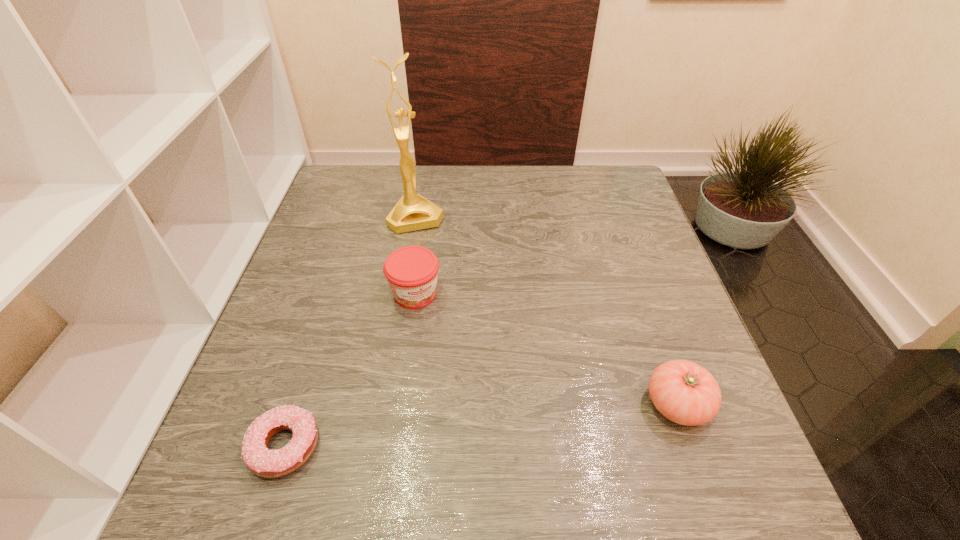
Identify the location of object that is at the near right corner. The image size is (960, 540). (684, 392).

Find the location of `free space at the far edge of the desktop`. free space at the far edge of the desktop is located at coordinates (545, 181).

You are a GUI agent. You are given a task and a screenshot of the screen. Output one action in this format:
    pyautogui.click(x=<x>, y=<y>)
    Task: Click on the vacant space at the near edge
    
    Given the screenshot: What is the action you would take?
    pyautogui.click(x=498, y=433)

Locate an element on the screen. This screenshot has height=540, width=960. vacant region at the left edge of the desktop is located at coordinates (313, 267).

This screenshot has width=960, height=540. I want to click on free space at the right edge of the desktop, so click(614, 221).

The image size is (960, 540). In the image, there is a desktop. Find the location of `vacant area at the far left corner`. vacant area at the far left corner is located at coordinates (387, 170).

In the image, there is a desktop. Where is `vacant area at the far right corner`? This screenshot has height=540, width=960. vacant area at the far right corner is located at coordinates (619, 168).

In order to click on empty space between the tallest object and the rightmost object in this screenshot , I will do `click(546, 310)`.

Find the location of a particular element. vacant area that lies between the shortest object and the farthest object is located at coordinates (350, 332).

The width and height of the screenshot is (960, 540). In order to click on vacant space that is in between the tomato and the leftmost object in this screenshot , I will do `click(481, 425)`.